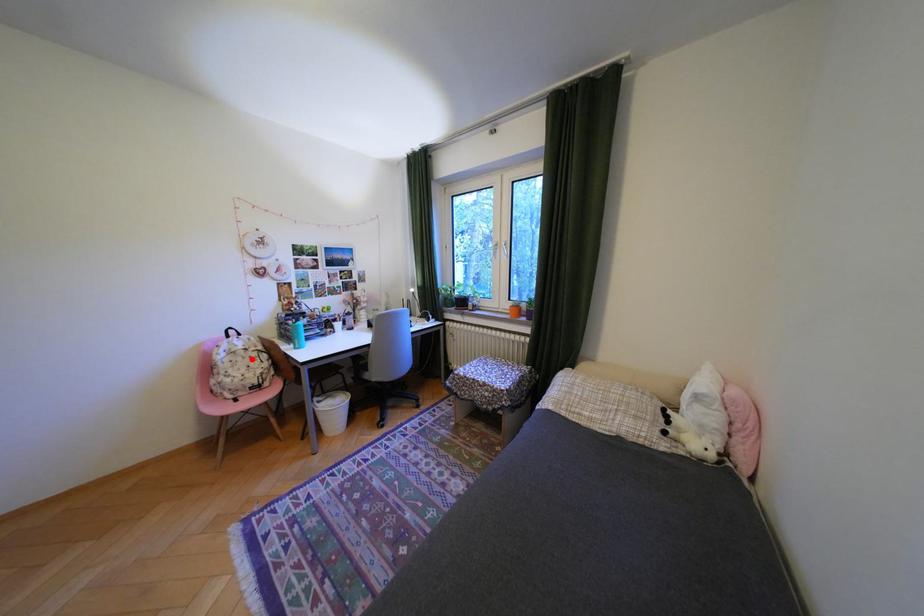
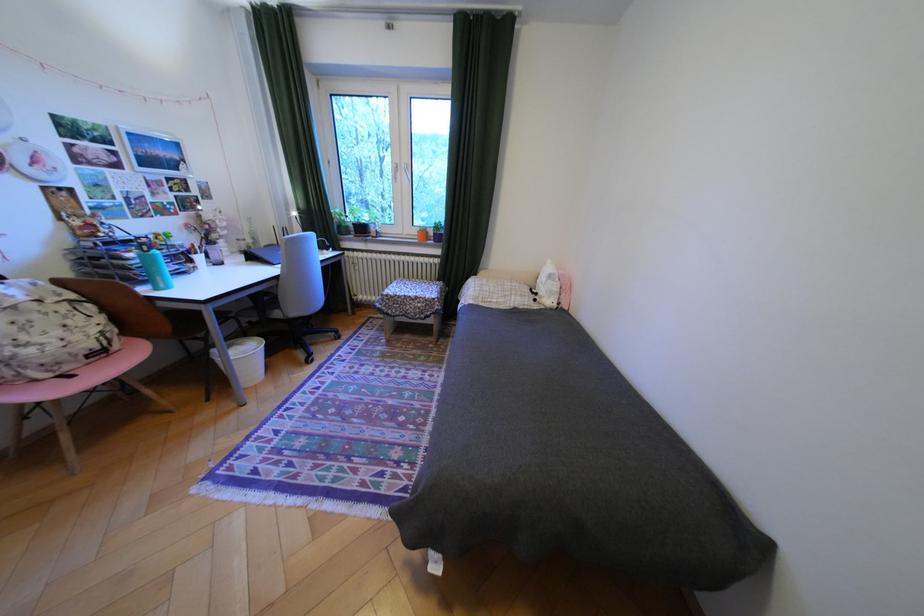
Question: I am providing you with two images of the same scene from different viewpoints. A red point is shown in image1. For the corresponding object point in image2, is it positioned nearer or farther from the camera?

Choices:
 (A) Nearer
 (B) Farther

Answer: (B)